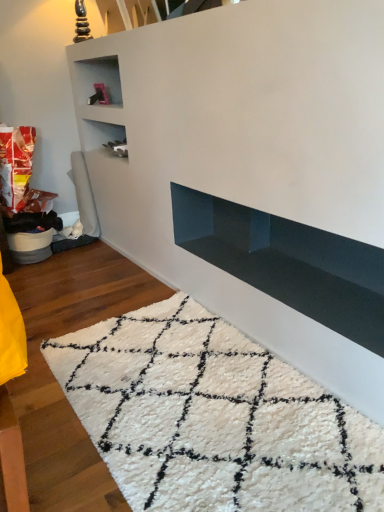
I want to click on empty space that is ontop of white shaggy rug at lower center (from a real-world perspective), so click(132, 394).